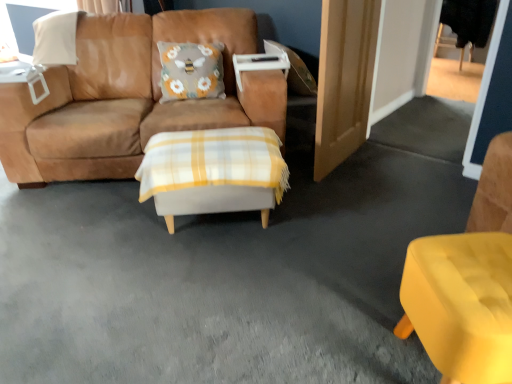
Question: Are wooden door at right and white plastic table at upper left, placed as the 2th table when sorted from bottom to top, beside each other?

Choices:
 (A) no
 (B) yes

Answer: (A)

Question: Is wooden door at right not inside white plastic table at upper left, which is the 2th table from right to left?

Choices:
 (A) no
 (B) yes

Answer: (B)

Question: Can you confirm if wooden door at right is smaller than white plastic table at upper left, the 1th table in the top-to-bottom sequence?

Choices:
 (A) no
 (B) yes

Answer: (A)

Question: Can white plastic table at upper left, which is the 2th table from right to left, be found inside wooden door at right?

Choices:
 (A) yes
 (B) no

Answer: (B)

Question: From the image's perspective, is wooden door at right located above white plastic table at upper left, which is counted as the 1th table, starting from the back?

Choices:
 (A) no
 (B) yes

Answer: (B)

Question: Is white plastic table at upper left, which is counted as the 1th table, starting from the left, spatially inside matte yellow chair at lower right, or outside of it?

Choices:
 (A) inside
 (B) outside

Answer: (B)

Question: Considering the positions of white plastic table at upper left, which is counted as the 1th table, starting from the back, and matte yellow chair at lower right in the image, is white plastic table at upper left, which is counted as the 1th table, starting from the back, wider or thinner than matte yellow chair at lower right?

Choices:
 (A) thin
 (B) wide

Answer: (A)

Question: From the image's perspective, is white plastic table at upper left, which is counted as the 1th table, starting from the back, located above or below matte yellow chair at lower right?

Choices:
 (A) above
 (B) below

Answer: (A)

Question: Is white plastic table at upper left, which is counted as the 1th table, starting from the back, taller or shorter than matte yellow chair at lower right?

Choices:
 (A) short
 (B) tall

Answer: (A)

Question: Looking at their shapes, would you say white plastic table at upper left, which is the 2th table from right to left, is wider or thinner than wooden door at right?

Choices:
 (A) wide
 (B) thin

Answer: (A)

Question: From a real-world perspective, relative to wooden door at right, is white plastic table at upper left, which is the 2th table from right to left, vertically above or below?

Choices:
 (A) above
 (B) below

Answer: (A)

Question: In terms of size, does white plastic table at upper left, which is counted as the 1th table, starting from the back, appear bigger or smaller than wooden door at right?

Choices:
 (A) small
 (B) big

Answer: (A)

Question: Considering their positions, is white plastic table at upper left, placed as the 2th table when sorted from bottom to top, located in front of or behind wooden door at right?

Choices:
 (A) behind
 (B) front

Answer: (A)

Question: Considering the positions of matte yellow chair at lower right and suede brown couch at center in the image, is matte yellow chair at lower right taller or shorter than suede brown couch at center?

Choices:
 (A) short
 (B) tall

Answer: (A)

Question: Is point (504, 362) closer or farther from the camera than point (251, 49)?

Choices:
 (A) farther
 (B) closer

Answer: (B)